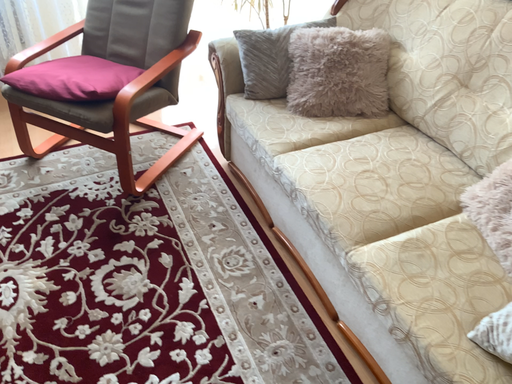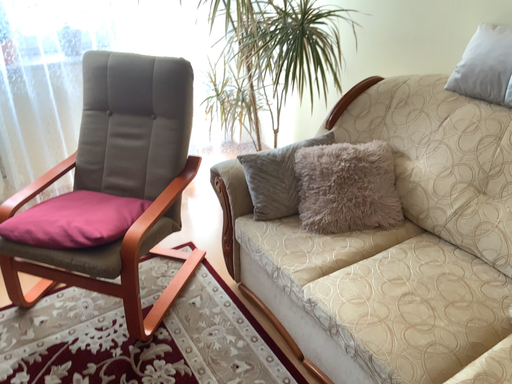
Question: Which way did the camera rotate in the video?

Choices:
 (A) rotated downward
 (B) rotated upward

Answer: (B)